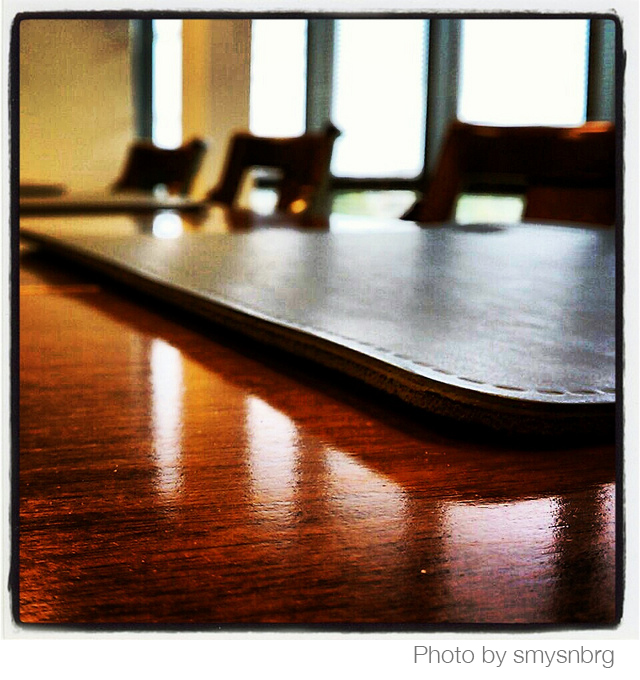
This screenshot has height=680, width=640. Find the location of `table mat`. table mat is located at coordinates (404, 307).